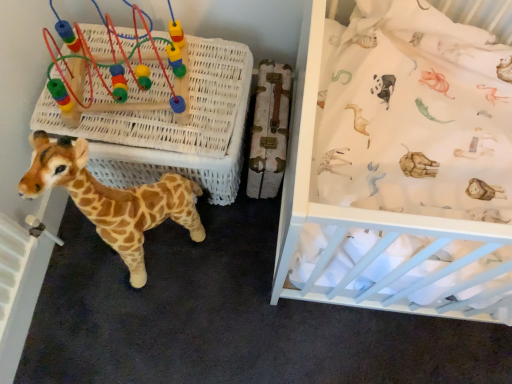
Find the location of a particular element. vacant area that is situated to the right of soft plush giraffe at lower left is located at coordinates (226, 260).